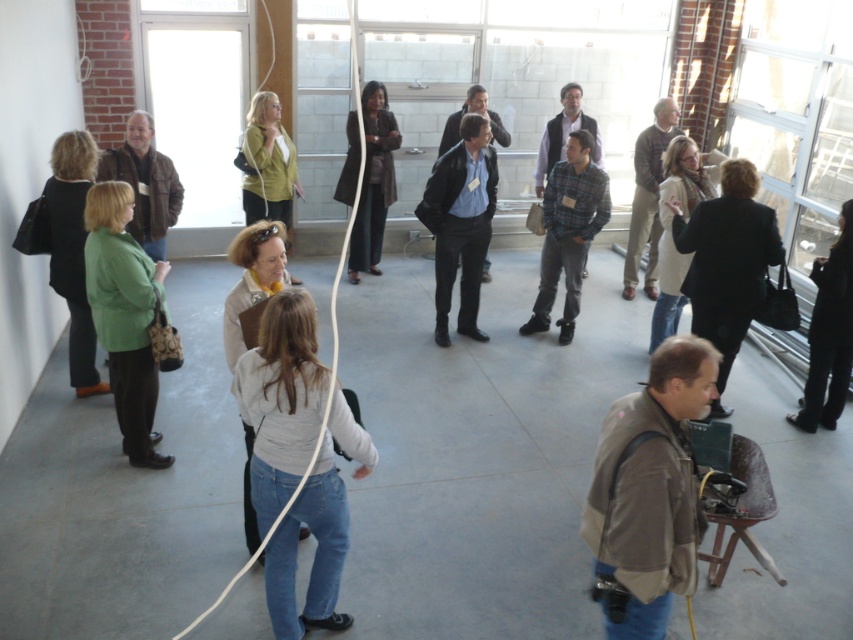
Which is above, green matte jacket at upper center or white fabric string at center?

Positioned higher is green matte jacket at upper center.

Can you confirm if green matte jacket at upper center is wider than white fabric string at center?

In fact, green matte jacket at upper center might be narrower than white fabric string at center.

What do you see at coordinates (268, 164) in the screenshot?
I see `green matte jacket at upper center` at bounding box center [268, 164].

Where is `green matte jacket at upper center`? Image resolution: width=853 pixels, height=640 pixels. green matte jacket at upper center is located at coordinates (268, 164).

Who is taller, dark brown leather jacket at center or white fabric string at center?

Standing taller between the two is dark brown leather jacket at center.

How much distance is there between dark brown leather jacket at center and white fabric string at center?

dark brown leather jacket at center is 14.68 feet from white fabric string at center.

Is point (381, 104) more distant than point (357, 88)?

Yes, point (381, 104) is farther from viewer.

I want to click on dark brown leather jacket at center, so click(373, 180).

Who is positioned more to the right, green fabric jacket at left or green matte jacket at upper center?

green matte jacket at upper center

Is point (61, 224) closer to camera compared to point (267, 182)?

That is True.

Where is `green fabric jacket at left`? green fabric jacket at left is located at coordinates (73, 250).